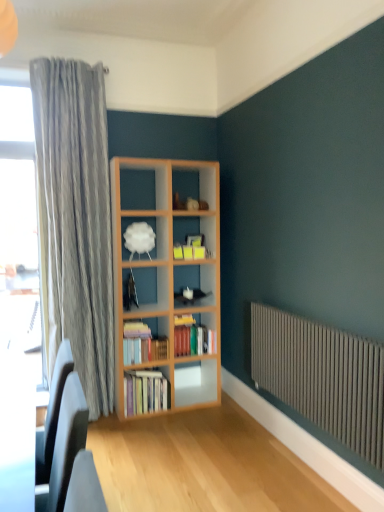
At what (x,y) coordinates should I click in order to perform the action: click on hardcover books at center, the 3th book viewed from the top. Please return your answer as a coordinate pair (x, y). Looking at the image, I should click on (145, 392).

This screenshot has width=384, height=512. What are the coordinates of `matte black swivel chair at lower left` in the screenshot? It's located at (66, 444).

This screenshot has height=512, width=384. What do you see at coordinates (142, 344) in the screenshot?
I see `hardcover books at center, which is the second book in top-to-bottom order` at bounding box center [142, 344].

The width and height of the screenshot is (384, 512). In order to click on white matte cloud at center in this screenshot , I will do `click(153, 231)`.

This screenshot has width=384, height=512. What are the coordinates of `hardcover books at center, the 3th book viewed from the top` in the screenshot? It's located at (145, 392).

Find the location of a particular element. Image resolution: width=384 pixels, height=512 pixels. swivel chair that appears on the left of hardcover books at center, the 1th book from the top is located at coordinates coord(66,444).

From the image's perspective, which object appears higher, matte black swivel chair at lower left or hardcover books at center, the third book positioned from the bottom?

hardcover books at center, the third book positioned from the bottom.

Is matte black swivel chair at lower left next to hardcover books at center, the 1th book from the top?

They are not placed beside each other.

Is matte black swivel chair at lower left smaller than hardcover books at center, the third book positioned from the bottom?

Incorrect, matte black swivel chair at lower left is not smaller in size than hardcover books at center, the third book positioned from the bottom.

Relative to hardcover books at center, the 1th book from the top, is hardcover books at center, which is the second book in top-to-bottom order, in front or behind?

hardcover books at center, which is the second book in top-to-bottom order, is in front of hardcover books at center, the 1th book from the top.

Does hardcover books at center, which is the second book in top-to-bottom order, turn towards hardcover books at center, the 1th book from the top?

No.

Between hardcover books at center, placed as the second book when sorted from bottom to top, and hardcover books at center, the third book positioned from the bottom, which one has larger width?

With larger width is hardcover books at center, the third book positioned from the bottom.

Between hardcover books at center, which is the second book in top-to-bottom order, and hardcover books at center, the 1th book from the top, which one has larger size?

hardcover books at center, the 1th book from the top.

Is white matte cloud at center oriented towards gray metallic radiator at lower right?

No, white matte cloud at center does not turn towards gray metallic radiator at lower right.

From a real-world perspective, is white matte cloud at center below gray metallic radiator at lower right?

No, from a real-world perspective, white matte cloud at center is not beneath gray metallic radiator at lower right.

From the image's perspective, relative to gray metallic radiator at lower right, is white matte cloud at center above or below?

From the image's perspective, white matte cloud at center appears above gray metallic radiator at lower right.

Between white matte cloud at center and hardcover books at center, the third book positioned from the bottom, which one has larger width?

With larger width is hardcover books at center, the third book positioned from the bottom.

What's the angular difference between white matte cloud at center and hardcover books at center, the third book positioned from the bottom,'s facing directions?

0.000524 degrees separate the facing orientations of white matte cloud at center and hardcover books at center, the third book positioned from the bottom.

Which is correct: white matte cloud at center is inside hardcover books at center, the 1th book from the top, or outside of it?

The correct answer is: outside.

Is point (148, 218) closer or farther from the camera than point (181, 341)?

Point (148, 218) is farther from the camera than point (181, 341).

Is hardcover books at center, which is counted as the first book, starting from the bottom, bigger than gray metallic radiator at lower right?

No.

From the image's perspective, is hardcover books at center, which is counted as the first book, starting from the bottom, under gray metallic radiator at lower right?

Correct, hardcover books at center, which is counted as the first book, starting from the bottom, appears lower than gray metallic radiator at lower right in the image.

Between hardcover books at center, the 3th book viewed from the top, and gray metallic radiator at lower right, which one has larger width?

Wider between the two is hardcover books at center, the 3th book viewed from the top.

Which object is more forward, hardcover books at center, the 3th book viewed from the top, or hardcover books at center, the 1th book from the top?

hardcover books at center, the 3th book viewed from the top, is closer to the camera.

Is point (137, 408) closer to camera compared to point (212, 330)?

That is True.

From the image's perspective, is hardcover books at center, which is counted as the first book, starting from the bottom, positioned above or below hardcover books at center, the third book positioned from the bottom?

Clearly, from the image's perspective, hardcover books at center, which is counted as the first book, starting from the bottom, is below hardcover books at center, the third book positioned from the bottom.

Based on their positions, is hardcover books at center, which is counted as the first book, starting from the bottom, located to the left or right of hardcover books at center, the third book positioned from the bottom?

hardcover books at center, which is counted as the first book, starting from the bottom, is positioned on hardcover books at center, the third book positioned from the bottom,'s left side.

Consider the image. Is gray metallic radiator at lower right directly adjacent to matte black swivel chair at lower left?

No, gray metallic radiator at lower right is not in contact with matte black swivel chair at lower left.

Between gray metallic radiator at lower right and matte black swivel chair at lower left, which one has less height?

matte black swivel chair at lower left is shorter.

What's the angular difference between gray metallic radiator at lower right and matte black swivel chair at lower left's facing directions?

The angle between the facing direction of gray metallic radiator at lower right and the facing direction of matte black swivel chair at lower left is 1.74 degrees.

Which is more to the right, gray metallic radiator at lower right or matte black swivel chair at lower left?

From the viewer's perspective, gray metallic radiator at lower right appears more on the right side.

In order to click on the 3rd book behind when counting from the matte black swivel chair at lower left in this screenshot , I will do `click(193, 338)`.

From a real-world perspective, which book is the 1st one underneath the hardcover books at center, the third book positioned from the bottom? Please provide its 2D coordinates.

[(142, 344)]

Which object lies further to the anchor point hardcover books at center, which is the second book in top-to-bottom order, matte black swivel chair at lower left or gray metallic radiator at lower right?

matte black swivel chair at lower left.

Based on their spatial positions, is hardcover books at center, the 3th book viewed from the top, or hardcover books at center, the third book positioned from the bottom, closer to hardcover books at center, which is the second book in top-to-bottom order?

The object closer to hardcover books at center, which is the second book in top-to-bottom order, is hardcover books at center, the 3th book viewed from the top.

From the image, which object appears to be farther from hardcover books at center, which is the second book in top-to-bottom order, hardcover books at center, the 3th book viewed from the top, or matte black swivel chair at lower left?

matte black swivel chair at lower left is positioned further to the anchor hardcover books at center, which is the second book in top-to-bottom order.

Which object lies further to the anchor point hardcover books at center, which is the second book in top-to-bottom order, hardcover books at center, the third book positioned from the bottom, or white matte cloud at center?

The object further to hardcover books at center, which is the second book in top-to-bottom order, is white matte cloud at center.

Which object lies nearer to the anchor point white matte cloud at center, hardcover books at center, the 3th book viewed from the top, or matte black swivel chair at lower left?

hardcover books at center, the 3th book viewed from the top, is closer to white matte cloud at center.

Which object lies nearer to the anchor point matte black swivel chair at lower left, hardcover books at center, which is counted as the first book, starting from the bottom, or white matte cloud at center?

Based on the image, hardcover books at center, which is counted as the first book, starting from the bottom, appears to be nearer to matte black swivel chair at lower left.

Considering their positions, is matte black swivel chair at lower left positioned further to gray metallic radiator at lower right than white matte cloud at center?

matte black swivel chair at lower left is positioned further to the anchor gray metallic radiator at lower right.

Considering their positions, is matte black swivel chair at lower left positioned further to hardcover books at center, the third book positioned from the bottom, than hardcover books at center, placed as the second book when sorted from bottom to top?

matte black swivel chair at lower left is positioned further to the anchor hardcover books at center, the third book positioned from the bottom.

This screenshot has height=512, width=384. In order to click on book positioned between matte black swivel chair at lower left and hardcover books at center, which is counted as the first book, starting from the bottom, from near to far in this screenshot , I will do `click(142, 344)`.

In order to click on shelf located between matte black swivel chair at lower left and hardcover books at center, the third book positioned from the bottom, in the depth direction in this screenshot , I will do `click(153, 231)`.

Image resolution: width=384 pixels, height=512 pixels. What are the coordinates of `shelf located between gray metallic radiator at lower right and hardcover books at center, which is counted as the first book, starting from the bottom, in the depth direction` in the screenshot? It's located at (153, 231).

At what (x,y) coordinates should I click in order to perform the action: click on radiator between matte black swivel chair at lower left and hardcover books at center, the 3th book viewed from the top, from front to back. Please return your answer as a coordinate pair (x, y). This screenshot has height=512, width=384. Looking at the image, I should click on (322, 377).